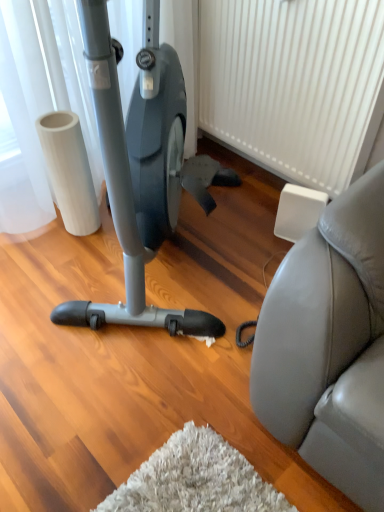
I want to click on vacant space in front of matte black stationary bicycle at center, so click(133, 409).